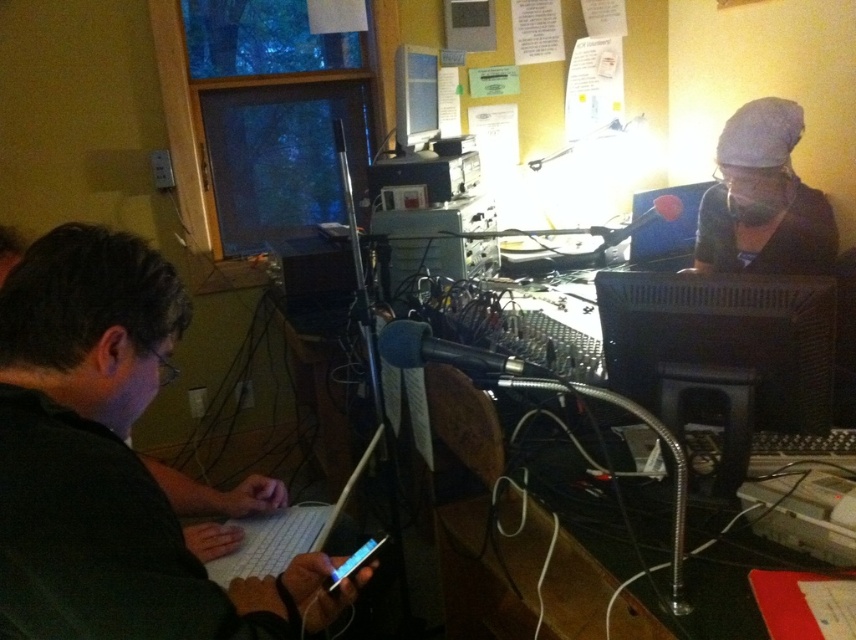
Does point (813, 241) lie behind point (241, 548)?

Yes, point (813, 241) is farther from viewer.

Is point (831, 266) farther from camera compared to point (262, 554)?

Yes, point (831, 266) is farther from viewer.

Find the location of a particular element. white fabric cap at upper right is located at coordinates click(764, 198).

Between white fabric cap at upper right and matte black monitor at upper center, which one appears on the right side from the viewer's perspective?

white fabric cap at upper right is more to the right.

Between point (771, 236) and point (403, 124), which one is positioned behind?

Point (403, 124)

You are a GUI agent. You are given a task and a screenshot of the screen. Output one action in this format:
    pyautogui.click(x=<x>, y=<y>)
    Task: Click on the white fabric cap at upper right
    
    Given the screenshot: What is the action you would take?
    pyautogui.click(x=764, y=198)

Is black matte laptop at left positioned before white plastic laptop at lower center?

Yes, black matte laptop at left is closer to the viewer.

Can you confirm if black matte laptop at left is thinner than white plastic laptop at lower center?

No, black matte laptop at left is not thinner than white plastic laptop at lower center.

Find the location of a particular element. The width and height of the screenshot is (856, 640). black matte laptop at left is located at coordinates (116, 464).